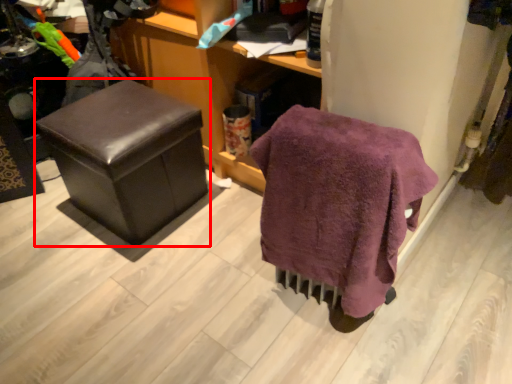
Question: Where is furniture (annotated by the red box) located in relation to bath towel in the image?

Choices:
 (A) left
 (B) right

Answer: (A)